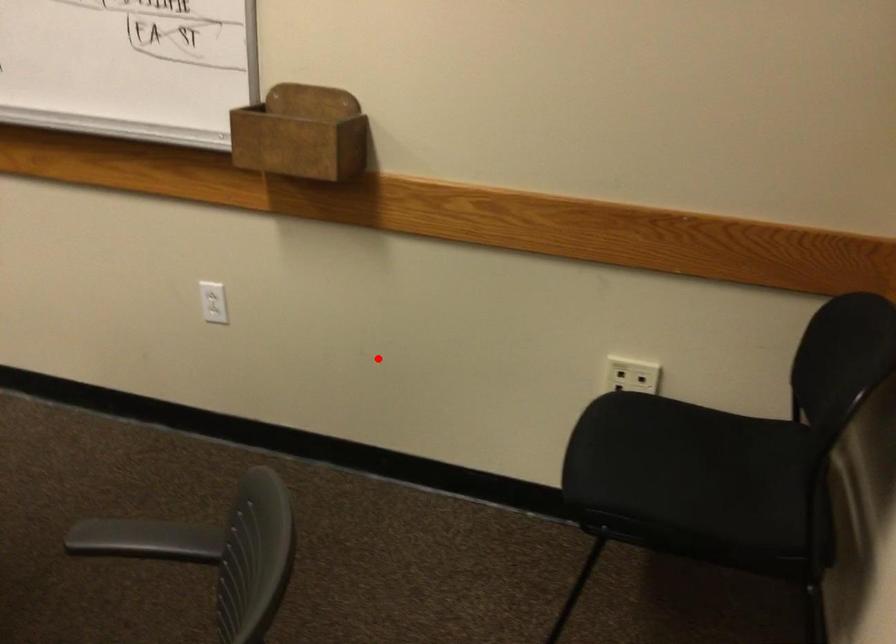
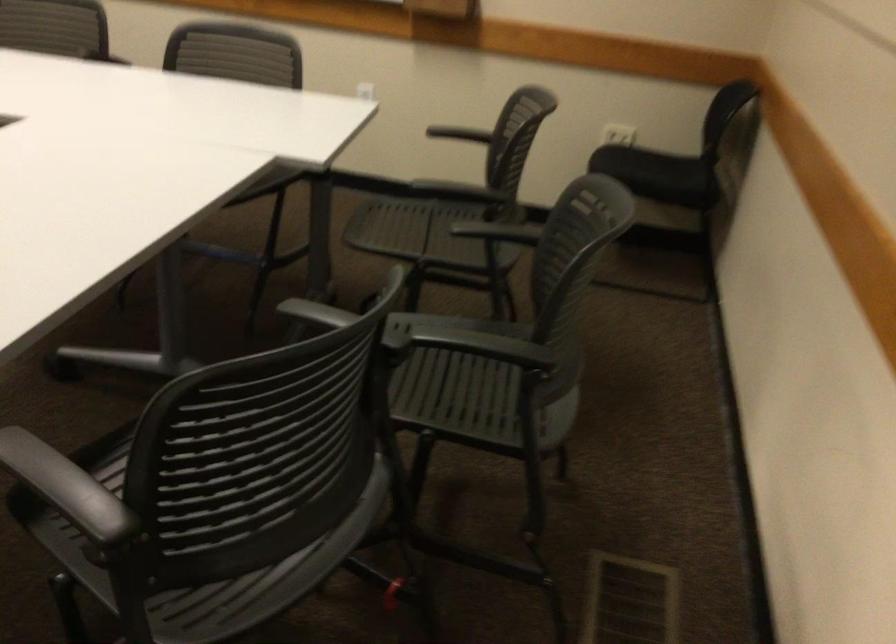
Locate, in the second image, the point that corresponds to the highlighted location in the first image.

(464, 131)